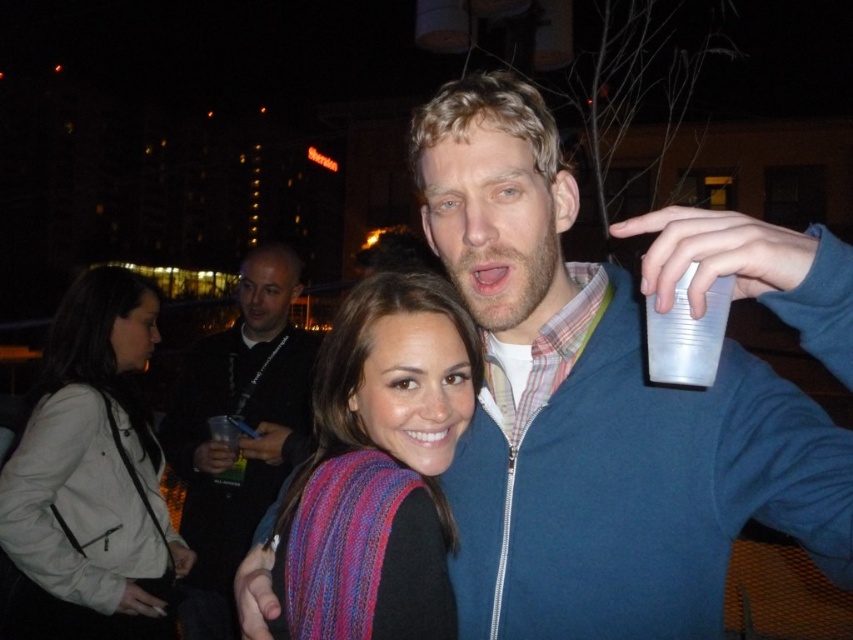
Which is more to the left, multicolored knitted scarf at center or black fabric shirt at center?

From the viewer's perspective, black fabric shirt at center appears more on the left side.

In the scene shown: Who is more distant from viewer, (378, 564) or (308, 433)?

Point (308, 433)

Who is more distant from viewer, (456, 634) or (267, 404)?

The point (267, 404) is behind.

Identify the location of multicolored knitted scarf at center. The height and width of the screenshot is (640, 853). (398, 422).

Consider the image. Can you confirm if multicolored knitted scarf at center is positioned below transparent plastic cup at upper right?

Correct, multicolored knitted scarf at center is located below transparent plastic cup at upper right.

Does multicolored knitted scarf at center come behind transparent plastic cup at upper right?

Yes, multicolored knitted scarf at center is behind transparent plastic cup at upper right.

Locate an element on the screen. The height and width of the screenshot is (640, 853). multicolored knitted scarf at center is located at coordinates (398, 422).

Is black fabric shirt at center to the right of transparent plastic cup at upper right from the viewer's perspective?

Incorrect, black fabric shirt at center is not on the right side of transparent plastic cup at upper right.

Can you confirm if black fabric shirt at center is taller than transparent plastic cup at upper right?

Yes, black fabric shirt at center is taller than transparent plastic cup at upper right.

At what (x,y) coordinates should I click in order to perform the action: click on black fabric shirt at center. Please return your answer as a coordinate pair (x, y). This screenshot has width=853, height=640. Looking at the image, I should click on (239, 438).